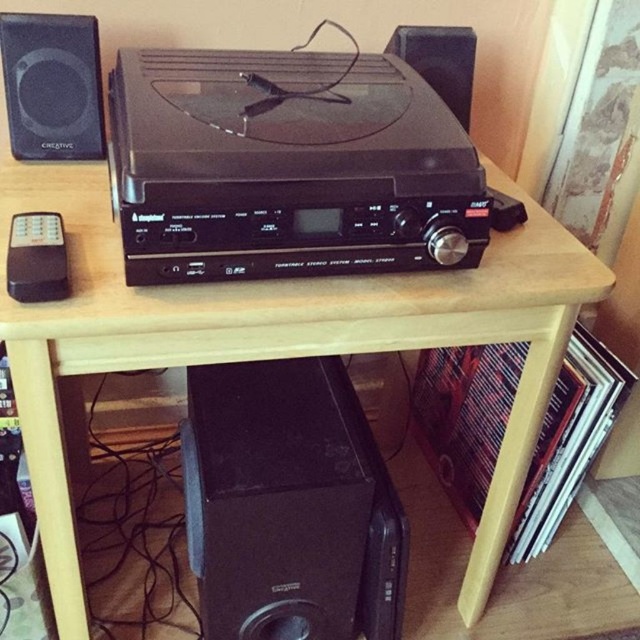
Question: Is black plastic stereo at center above black matte speaker at upper center?

Choices:
 (A) yes
 (B) no

Answer: (B)

Question: Is black plastic stereo at center bigger than matte black speaker at upper left?

Choices:
 (A) yes
 (B) no

Answer: (A)

Question: Which object is positioned farthest from the black plastic stereo at center?

Choices:
 (A) matte black speaker at upper left
 (B) black matte speaker at upper center

Answer: (B)

Question: Which of the following is the closest to the observer?

Choices:
 (A) black plastic stereo at center
 (B) black matte speaker at upper center

Answer: (A)

Question: Does black plastic stereo at center appear under black matte speaker at upper center?

Choices:
 (A) no
 (B) yes

Answer: (B)

Question: Which of the following is the closest to the observer?

Choices:
 (A) (44, 108)
 (B) (424, 52)
 (C) (141, 188)

Answer: (C)